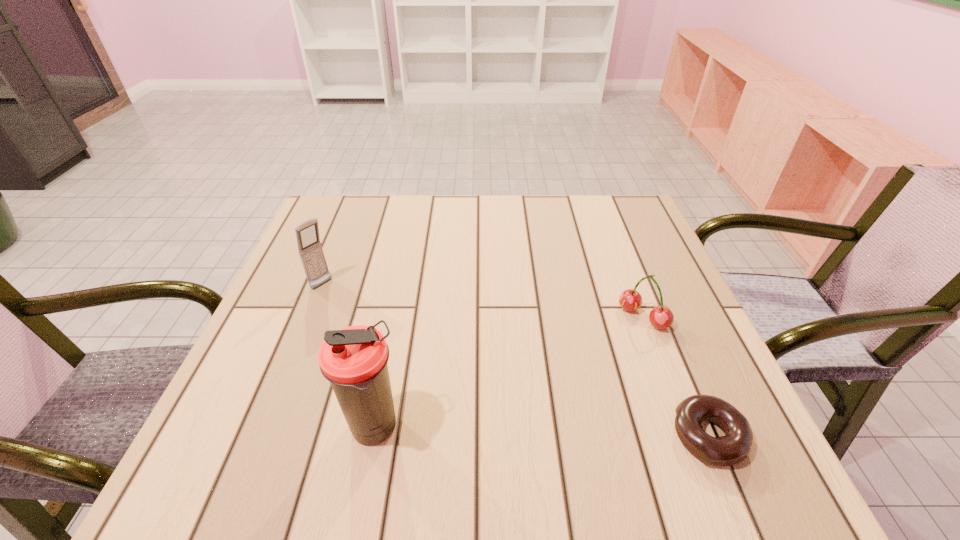
I want to click on vacant space in between the doughnut and the third tallest object, so click(x=675, y=376).

Locate an element on the screen. The image size is (960, 540). unoccupied position between the doughnut and the tallest object is located at coordinates (541, 431).

Where is `vacant space that's between the doughnut and the thermos bottle`? Image resolution: width=960 pixels, height=540 pixels. vacant space that's between the doughnut and the thermos bottle is located at coordinates (541, 431).

The height and width of the screenshot is (540, 960). I want to click on free spot between the third nearest object and the third object from right to left, so click(509, 373).

Locate an element on the screen. free space that is in between the thermos bottle and the doughnut is located at coordinates (541, 431).

At what (x,y) coordinates should I click in order to perform the action: click on free spot between the cellular telephone and the doughnut. Please return your answer as a coordinate pair (x, y). Looking at the image, I should click on (516, 360).

Where is `object that is the closest to the cherry`? The width and height of the screenshot is (960, 540). object that is the closest to the cherry is located at coordinates point(735,446).

Identify which object is the nearest to the cherry. Please provide its 2D coordinates. Your answer should be formatted as a tuple, i.e. [(x, y)], where the tuple contains the x and y coordinates of a point satisfying the conditions above.

[(735, 446)]

The height and width of the screenshot is (540, 960). Identify the location of free location that satisfies the following two spatial constraints: 1. on the front side of the cherry; 2. on the left side of the shortest object. (688, 435).

Locate an element on the screen. The width and height of the screenshot is (960, 540). free spot that satisfies the following two spatial constraints: 1. on the front side of the tallest object; 2. on the right side of the doughnut is located at coordinates (373, 435).